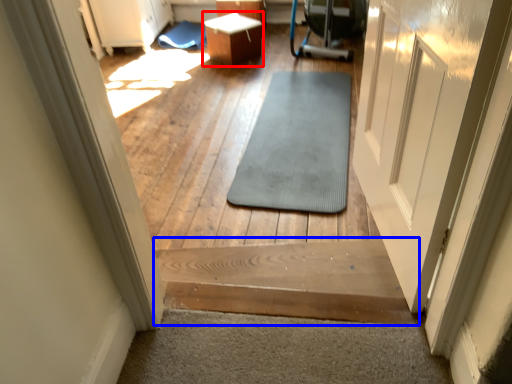
Question: Which of the following is the closest to the observer, table (highlighted by a red box) or stairs (highlighted by a blue box)?

Choices:
 (A) table
 (B) stairs

Answer: (B)